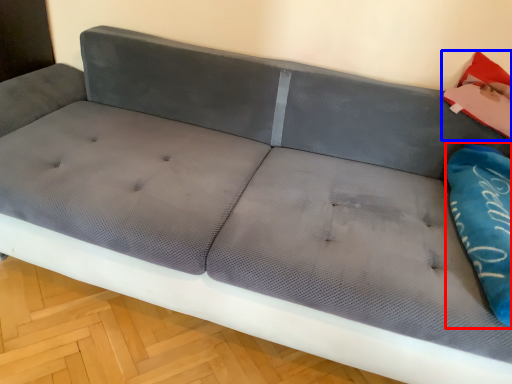
Question: Which of the following is the closest to the observer, pillow (highlighted by a red box) or material (highlighted by a blue box)?

Choices:
 (A) pillow
 (B) material

Answer: (A)